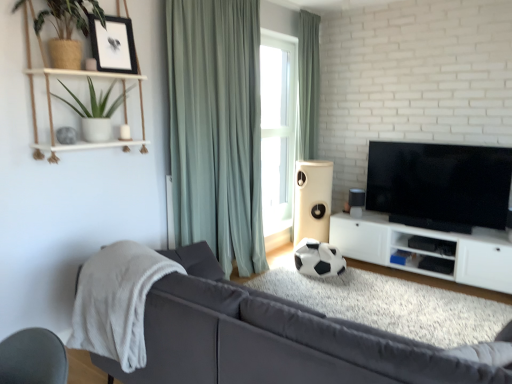
Question: Does black matte picture frame at upper left lie in front of satin black speaker at lower right, which is the 1th speaker from right to left?

Choices:
 (A) no
 (B) yes

Answer: (B)

Question: Is black matte picture frame at upper left outside satin black speaker at lower right, which is the 1th speaker from right to left?

Choices:
 (A) no
 (B) yes

Answer: (B)

Question: From the image's perspective, is black matte picture frame at upper left located above satin black speaker at lower right, which is the 1th speaker from right to left?

Choices:
 (A) no
 (B) yes

Answer: (B)

Question: From the image's perspective, is black matte picture frame at upper left beneath satin black speaker at lower right, which is the 2th speaker in left-to-right order?

Choices:
 (A) no
 (B) yes

Answer: (A)

Question: Can you confirm if black matte picture frame at upper left is taller than satin black speaker at lower right, which is the 1th speaker from right to left?

Choices:
 (A) no
 (B) yes

Answer: (B)

Question: Is black matte picture frame at upper left far away from satin black speaker at lower right, which is the 2th speaker in left-to-right order?

Choices:
 (A) no
 (B) yes

Answer: (B)

Question: Is light green fabric curtain at upper center, arranged as the 1th curtain when viewed from the right, thinner than white fluffy blanket at left?

Choices:
 (A) yes
 (B) no

Answer: (A)

Question: From a real-world perspective, is light green fabric curtain at upper center, the second curtain from the front, located higher than white fluffy blanket at left?

Choices:
 (A) no
 (B) yes

Answer: (B)

Question: From a real-world perspective, is light green fabric curtain at upper center, the second curtain from the front, located beneath white fluffy blanket at left?

Choices:
 (A) no
 (B) yes

Answer: (A)

Question: From the image's perspective, is light green fabric curtain at upper center, arranged as the 1th curtain when viewed from the right, located beneath white fluffy blanket at left?

Choices:
 (A) no
 (B) yes

Answer: (A)

Question: Is light green fabric curtain at upper center, the second curtain from the front, not inside white fluffy blanket at left?

Choices:
 (A) yes
 (B) no

Answer: (A)

Question: Can you confirm if light green fabric curtain at upper center, which is counted as the 1th curtain, starting from the back, is positioned to the left of white fluffy blanket at left?

Choices:
 (A) no
 (B) yes

Answer: (A)

Question: From a real-world perspective, is black matte picture frame at upper left located higher than light green fabric curtain at upper center, placed as the 2th curtain when sorted from left to right?

Choices:
 (A) yes
 (B) no

Answer: (A)